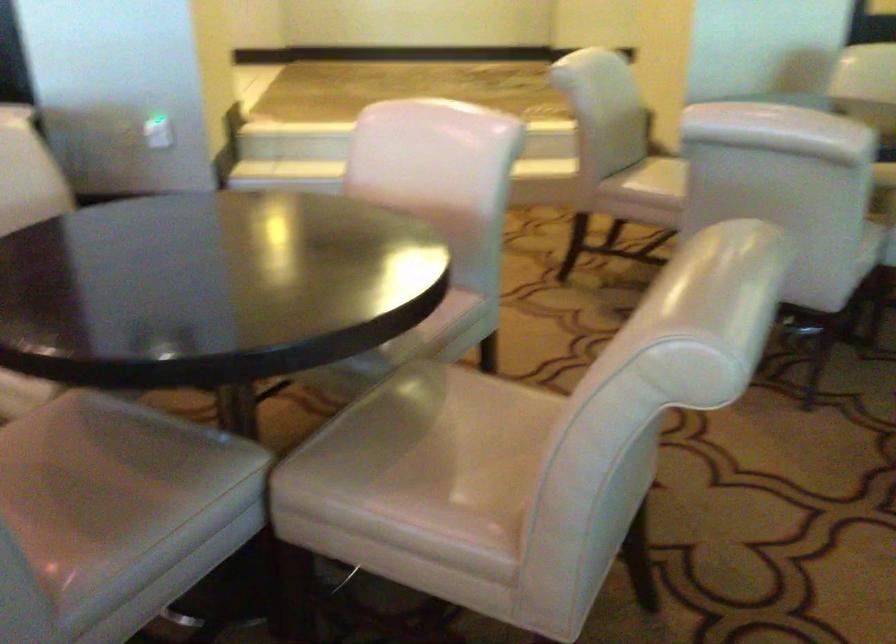
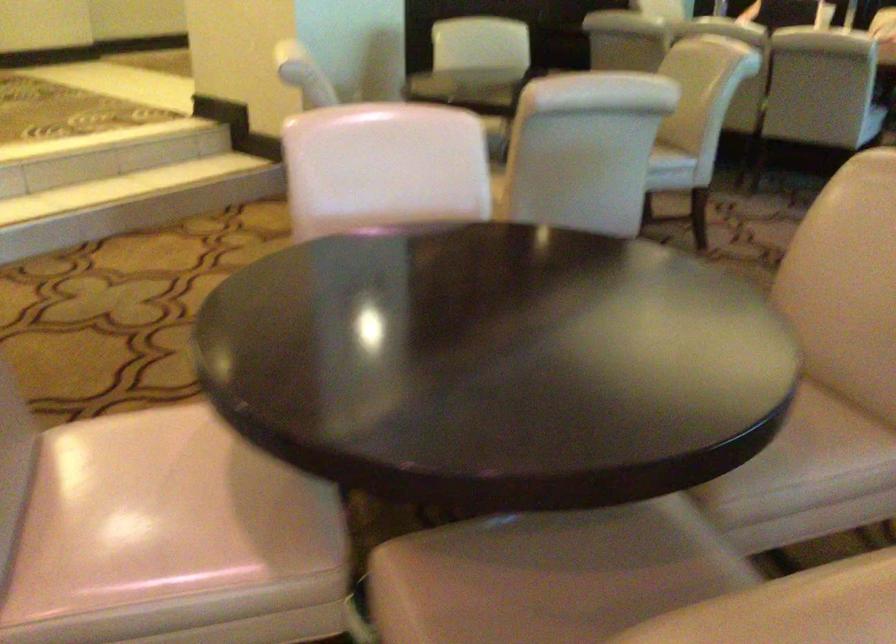
The point at (462, 489) is marked in the first image. Where is the corresponding point in the second image?

(814, 424)